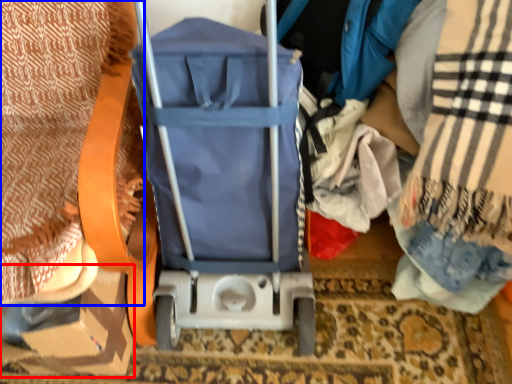
Question: Which of the following is the closest to the observer, cardboard box (highlighted by a red box) or blanket (highlighted by a blue box)?

Choices:
 (A) cardboard box
 (B) blanket

Answer: (B)